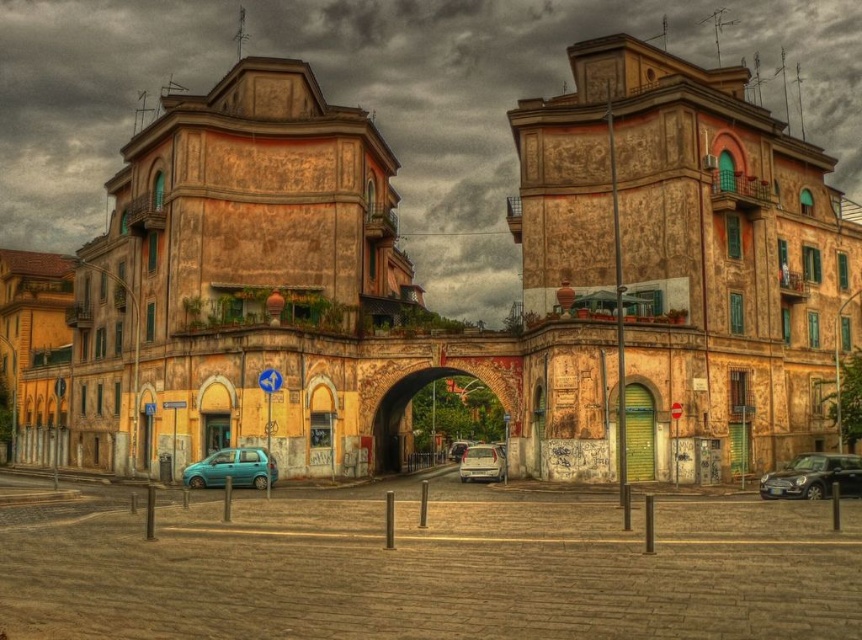
Question: Can you confirm if matte silver car at center is positioned below matte silver van at center?

Choices:
 (A) no
 (B) yes

Answer: (A)

Question: Estimate the real-world distances between objects in this image. Which object is closer to the metallic silver hatchback at center?

Choices:
 (A) yellow textured building at center
 (B) matte silver van at center
 (C) teal matte hatchback at lower left

Answer: (A)

Question: Can you confirm if yellow textured building at center is positioned to the right of matte silver car at center?

Choices:
 (A) no
 (B) yes

Answer: (A)

Question: Estimate the real-world distances between objects in this image. Which object is closer to the matte silver van at center?

Choices:
 (A) yellow textured building at center
 (B) rustic stone archway at center
 (C) metallic silver hatchback at center
 (D) teal matte hatchback at lower left

Answer: (B)

Question: In this image, where is metallic silver hatchback at center located relative to teal matte hatchback at lower left?

Choices:
 (A) above
 (B) below

Answer: (B)

Question: Among these objects, which one is nearest to the camera?

Choices:
 (A) matte silver van at center
 (B) matte silver car at center

Answer: (B)